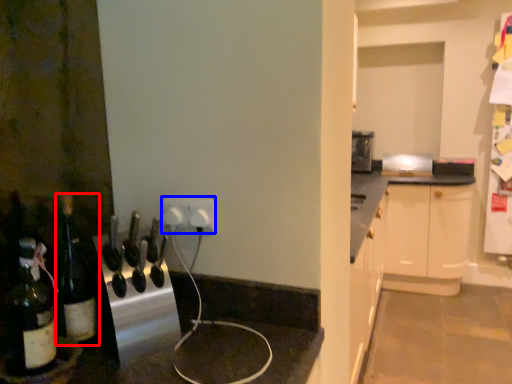
Question: Which object appears farthest to the camera in this image, bottle (highlighted by a red box) or electric outlet (highlighted by a blue box)?

Choices:
 (A) bottle
 (B) electric outlet

Answer: (B)